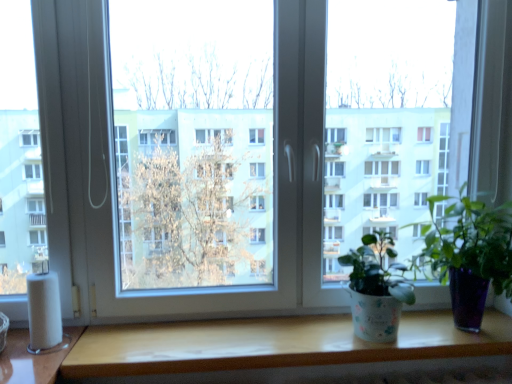
In order to face green glossy plant at center, positioned as the 1th houseplant in right-to-left order, should I rotate leftwards or rightwards?

You should rotate right by 27.500 degrees.

Describe the element at coordinates (469, 255) in the screenshot. I see `green glossy plant at center, which is the second houseplant in left-to-right order` at that location.

Image resolution: width=512 pixels, height=384 pixels. I want to click on wooden table at lower center, so click(291, 352).

At what (x,y) coordinates should I click in order to perform the action: click on white matte toilet paper at lower left. Please return your answer as a coordinate pair (x, y). Looking at the image, I should click on (44, 312).

From a real-world perspective, does green glossy plant at center, which is the second houseplant in left-to-right order, stand above wooden table at lower center?

Yes.

Is green glossy plant at center, positioned as the 1th houseplant in right-to-left order, bigger than wooden table at lower center?

Indeed, green glossy plant at center, positioned as the 1th houseplant in right-to-left order, has a larger size compared to wooden table at lower center.

Is green glossy plant at center, positioned as the 1th houseplant in right-to-left order, behind wooden table at lower center?

No, it is not.

How far apart are green glossy plant at center, positioned as the 1th houseplant in right-to-left order, and wooden table at lower center?

A distance of 14.15 inches exists between green glossy plant at center, positioned as the 1th houseplant in right-to-left order, and wooden table at lower center.

Does white textured pot at center, the 2th houseplant from the right, have a smaller size compared to wooden table at lower center?

No, white textured pot at center, the 2th houseplant from the right, is not smaller than wooden table at lower center.

Is the surface of white textured pot at center, which ranks as the first houseplant in left-to-right order, in direct contact with wooden table at lower center?

white textured pot at center, which ranks as the first houseplant in left-to-right order, is not next to wooden table at lower center, and they're not touching.

In order to click on houseplant behind the wooden table at lower center in this screenshot , I will do `click(376, 289)`.

Does white textured pot at center, which ranks as the first houseplant in left-to-right order, appear on the left side of wooden table at lower center?

No, white textured pot at center, which ranks as the first houseplant in left-to-right order, is not to the left of wooden table at lower center.

Consider the image. Is wooden table at lower center taller than white matte toilet paper at lower left?

No, wooden table at lower center is not taller than white matte toilet paper at lower left.

Is wooden table at lower center bigger than white matte toilet paper at lower left?

Indeed, wooden table at lower center has a larger size compared to white matte toilet paper at lower left.

From a real-world perspective, is wooden table at lower center located beneath white matte toilet paper at lower left?

Yes, from a real-world perspective, wooden table at lower center is under white matte toilet paper at lower left.

Are white matte toilet paper at lower left and white textured pot at center, the 2th houseplant from the right, located far from each other?

Yes, white matte toilet paper at lower left and white textured pot at center, the 2th houseplant from the right, are located far from each other.

Can you confirm if white matte toilet paper at lower left is positioned to the right of white textured pot at center, the 2th houseplant from the right?

In fact, white matte toilet paper at lower left is to the left of white textured pot at center, the 2th houseplant from the right.

How different are the orientations of white matte toilet paper at lower left and white textured pot at center, the 2th houseplant from the right, in degrees?

They differ by 2.21 degrees in their facing directions.

Is white matte toilet paper at lower left surrounding white textured pot at center, the 2th houseplant from the right?

No, white textured pot at center, the 2th houseplant from the right, is not inside white matte toilet paper at lower left.

From a real-world perspective, is wooden table at lower center located higher than white textured pot at center, the 2th houseplant from the right?

No, from a real-world perspective, wooden table at lower center is not on top of white textured pot at center, the 2th houseplant from the right.

From the picture: Which of these two, wooden table at lower center or white textured pot at center, the 2th houseplant from the right, is thinner?

With smaller width is white textured pot at center, the 2th houseplant from the right.

Consider the image. Between wooden table at lower center and white textured pot at center, which ranks as the first houseplant in left-to-right order, which one appears on the left side from the viewer's perspective?

wooden table at lower center.

Are wooden table at lower center and white textured pot at center, which ranks as the first houseplant in left-to-right order, far apart?

No.

This screenshot has width=512, height=384. Find the location of `the 1st houseplant in front of the white matte toilet paper at lower left, starting your count from the anchor`. the 1st houseplant in front of the white matte toilet paper at lower left, starting your count from the anchor is located at coordinates (376, 289).

Is white textured pot at center, the 2th houseplant from the right, facing towards white matte toilet paper at lower left?

No, white textured pot at center, the 2th houseplant from the right, is not turned towards white matte toilet paper at lower left.

Looking at this image, which is in front, white textured pot at center, the 2th houseplant from the right, or white matte toilet paper at lower left?

white textured pot at center, the 2th houseplant from the right, is more forward.

Looking at their sizes, would you say white textured pot at center, the 2th houseplant from the right, is wider or thinner than white matte toilet paper at lower left?

white textured pot at center, the 2th houseplant from the right, is wider than white matte toilet paper at lower left.

From the image's perspective, does wooden table at lower center appear lower than green glossy plant at center, which is the second houseplant in left-to-right order?

Indeed, from the image's perspective, wooden table at lower center is shown beneath green glossy plant at center, which is the second houseplant in left-to-right order.

Considering the sizes of objects wooden table at lower center and green glossy plant at center, positioned as the 1th houseplant in right-to-left order, in the image provided, who is bigger, wooden table at lower center or green glossy plant at center, positioned as the 1th houseplant in right-to-left order,?

green glossy plant at center, positioned as the 1th houseplant in right-to-left order, is bigger.

Is wooden table at lower center to the left of green glossy plant at center, which is the second houseplant in left-to-right order, from the viewer's perspective?

Yes.

Where is `houseplant located in front of the wooden table at lower center`? Image resolution: width=512 pixels, height=384 pixels. houseplant located in front of the wooden table at lower center is located at coordinates (469, 255).

The width and height of the screenshot is (512, 384). Identify the location of table that appears below the white textured pot at center, the 2th houseplant from the right (from a real-world perspective). (291, 352).

From the image, which object appears to be nearer to green glossy plant at center, which is the second houseplant in left-to-right order, white textured pot at center, the 2th houseplant from the right, or white matte toilet paper at lower left?

The object closer to green glossy plant at center, which is the second houseplant in left-to-right order, is white textured pot at center, the 2th houseplant from the right.

Looking at the image, which one is located further to white matte toilet paper at lower left, green glossy plant at center, which is the second houseplant in left-to-right order, or white textured pot at center, which ranks as the first houseplant in left-to-right order?

The object further to white matte toilet paper at lower left is green glossy plant at center, which is the second houseplant in left-to-right order.

From the image, which object appears to be farther from white matte toilet paper at lower left, wooden table at lower center or green glossy plant at center, positioned as the 1th houseplant in right-to-left order?

Among the two, green glossy plant at center, positioned as the 1th houseplant in right-to-left order, is located further to white matte toilet paper at lower left.

Based on their spatial positions, is white matte toilet paper at lower left or white textured pot at center, the 2th houseplant from the right, further from wooden table at lower center?

white matte toilet paper at lower left is further to wooden table at lower center.

Which object lies further to the anchor point green glossy plant at center, positioned as the 1th houseplant in right-to-left order, white textured pot at center, which ranks as the first houseplant in left-to-right order, or wooden table at lower center?

Among the two, wooden table at lower center is located further to green glossy plant at center, positioned as the 1th houseplant in right-to-left order.

Based on their spatial positions, is white textured pot at center, which ranks as the first houseplant in left-to-right order, or green glossy plant at center, which is the second houseplant in left-to-right order, further from white matte toilet paper at lower left?

green glossy plant at center, which is the second houseplant in left-to-right order, is positioned further to the anchor white matte toilet paper at lower left.

Looking at the image, which one is located closer to white textured pot at center, the 2th houseplant from the right, white matte toilet paper at lower left or green glossy plant at center, which is the second houseplant in left-to-right order?

The object closer to white textured pot at center, the 2th houseplant from the right, is green glossy plant at center, which is the second houseplant in left-to-right order.

When comparing their distances from green glossy plant at center, which is the second houseplant in left-to-right order, does white matte toilet paper at lower left or wooden table at lower center seem closer?

wooden table at lower center is positioned closer to the anchor green glossy plant at center, which is the second houseplant in left-to-right order.

Identify the location of houseplant between white matte toilet paper at lower left and green glossy plant at center, positioned as the 1th houseplant in right-to-left order, in the horizontal direction. Image resolution: width=512 pixels, height=384 pixels. (376, 289).

The width and height of the screenshot is (512, 384). I want to click on houseplant between wooden table at lower center and green glossy plant at center, positioned as the 1th houseplant in right-to-left order, in the horizontal direction, so click(376, 289).

Where is `table between white matte toilet paper at lower left and white textured pot at center, which ranks as the first houseplant in left-to-right order`? table between white matte toilet paper at lower left and white textured pot at center, which ranks as the first houseplant in left-to-right order is located at coordinates (291, 352).

Find the location of a particular element. This screenshot has height=384, width=512. table between white matte toilet paper at lower left and green glossy plant at center, positioned as the 1th houseplant in right-to-left order, from left to right is located at coordinates (291, 352).